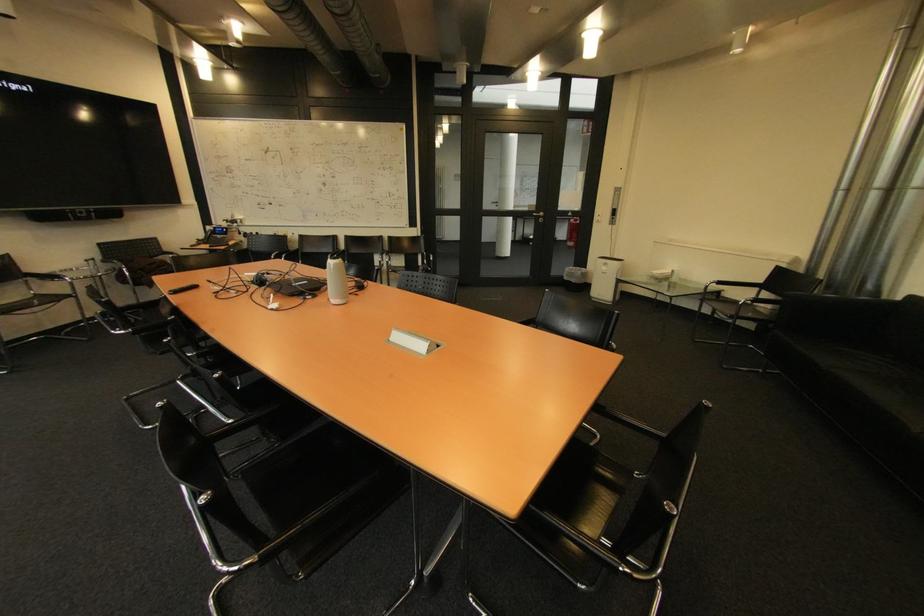
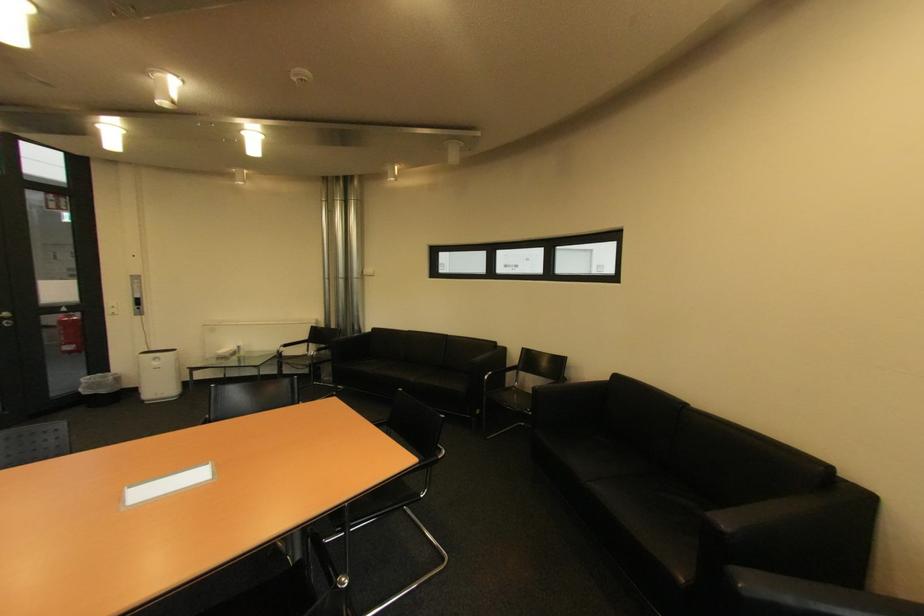
The point at [550,215] is marked in the first image. Where is the corresponding point in the second image?

(14, 315)